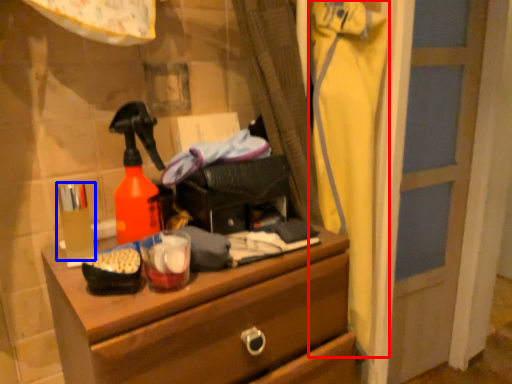
Question: Which object is closer to the camera taking this photo, clothing (highlighted by a red box) or toiletry (highlighted by a blue box)?

Choices:
 (A) clothing
 (B) toiletry

Answer: (B)